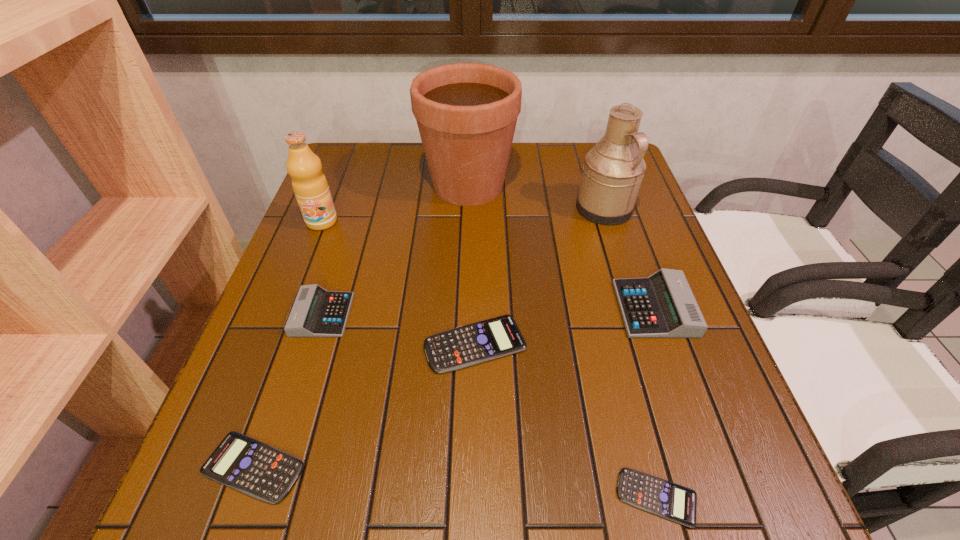
In order to click on free location that satisfies the following two spatial constraints: 1. on the back side of the right gray calculator; 2. on the left side of the shortest object in this screenshot , I will do `click(608, 308)`.

The width and height of the screenshot is (960, 540). Find the location of `blank space that satisfies the following two spatial constraints: 1. on the front label of the smaller gray calculator; 2. on the right side of the third tallest object`. blank space that satisfies the following two spatial constraints: 1. on the front label of the smaller gray calculator; 2. on the right side of the third tallest object is located at coordinates (285, 315).